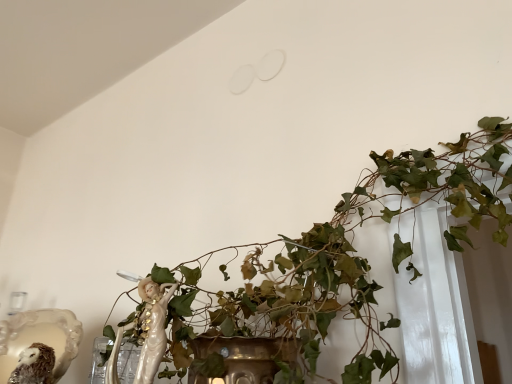
Where is `green leafy plant at center`? green leafy plant at center is located at coordinates (335, 264).

What do you see at coordinates (335, 264) in the screenshot? The width and height of the screenshot is (512, 384). I see `green leafy plant at center` at bounding box center [335, 264].

What do you see at coordinates (34, 365) in the screenshot?
I see `fuzzy brown owl at lower left` at bounding box center [34, 365].

You are a GUI agent. You are given a task and a screenshot of the screen. Output one action in this format:
    pyautogui.click(x=<x>, y=<y>)
    Task: Click on the fuzzy brown owl at lower left
    This screenshot has width=512, height=384.
    Given the screenshot: What is the action you would take?
    pyautogui.click(x=34, y=365)

Identify the location of green leafy plant at center. (335, 264).

From the picture: Is green leafy plant at center to the right of fuzzy brown owl at lower left from the viewer's perspective?

Yes, green leafy plant at center is to the right of fuzzy brown owl at lower left.

Which object is more forward, green leafy plant at center or fuzzy brown owl at lower left?

green leafy plant at center.

Is point (200, 358) behind point (44, 370)?

No.

From the image's perspective, which object appears higher, green leafy plant at center or fuzzy brown owl at lower left?

green leafy plant at center, from the image's perspective.

From a real-world perspective, relative to fuzzy brown owl at lower left, is green leafy plant at center vertically above or below?

From a real-world perspective, green leafy plant at center is physically above fuzzy brown owl at lower left.

Considering the sizes of green leafy plant at center and fuzzy brown owl at lower left in the image, is green leafy plant at center wider or thinner than fuzzy brown owl at lower left?

green leafy plant at center is wider than fuzzy brown owl at lower left.

Who is shorter, green leafy plant at center or fuzzy brown owl at lower left?

fuzzy brown owl at lower left is shorter.

From the picture: Considering the sizes of objects green leafy plant at center and fuzzy brown owl at lower left in the image provided, who is bigger, green leafy plant at center or fuzzy brown owl at lower left?

Bigger between the two is green leafy plant at center.

Is green leafy plant at center located outside fuzzy brown owl at lower left?

Indeed, green leafy plant at center is completely outside fuzzy brown owl at lower left.

Is the surface of green leafy plant at center in direct contact with fuzzy brown owl at lower left?

They are not placed beside each other.

Is green leafy plant at center looking in the opposite direction of fuzzy brown owl at lower left?

No.

Can you tell me how much green leafy plant at center and fuzzy brown owl at lower left differ in facing direction?

4.03 degrees separate the facing orientations of green leafy plant at center and fuzzy brown owl at lower left.

How distant is green leafy plant at center from fuzzy brown owl at lower left?

green leafy plant at center is 20.41 inches from fuzzy brown owl at lower left.

The image size is (512, 384). Identify the location of animal on the left of green leafy plant at center. (34, 365).

Does fuzzy brown owl at lower left appear on the right side of green leafy plant at center?

No.

Which object is further away from the camera, fuzzy brown owl at lower left or green leafy plant at center?

fuzzy brown owl at lower left is behind.

Based on the photo, which point is more distant from viewer, (28, 374) or (387, 366)?

The point (28, 374) is behind.

From the image's perspective, is fuzzy brown owl at lower left located beneath green leafy plant at center?

Yes, from the image's perspective, fuzzy brown owl at lower left is below green leafy plant at center.

From a real-world perspective, which object rests below the other?

In real-world perspective, fuzzy brown owl at lower left is lower.

Considering the sizes of objects fuzzy brown owl at lower left and green leafy plant at center in the image provided, who is thinner, fuzzy brown owl at lower left or green leafy plant at center?

fuzzy brown owl at lower left is thinner.

In terms of height, does fuzzy brown owl at lower left look taller or shorter compared to green leafy plant at center?

Clearly, fuzzy brown owl at lower left is shorter compared to green leafy plant at center.

Consider the image. Which of these two, fuzzy brown owl at lower left or green leafy plant at center, is bigger?

green leafy plant at center.

Is fuzzy brown owl at lower left not within green leafy plant at center?

fuzzy brown owl at lower left lies outside green leafy plant at center's area.

Can you see fuzzy brown owl at lower left touching green leafy plant at center?

No, fuzzy brown owl at lower left is not with green leafy plant at center.

Could you tell me if fuzzy brown owl at lower left is turned towards green leafy plant at center?

No, fuzzy brown owl at lower left is not aimed at green leafy plant at center.

Image resolution: width=512 pixels, height=384 pixels. I want to click on houseplant in front of the fuzzy brown owl at lower left, so click(335, 264).

Find the location of a particular element. houseplant above the fuzzy brown owl at lower left (from the image's perspective) is located at coordinates (335, 264).

This screenshot has height=384, width=512. I want to click on houseplant on the right of fuzzy brown owl at lower left, so click(335, 264).